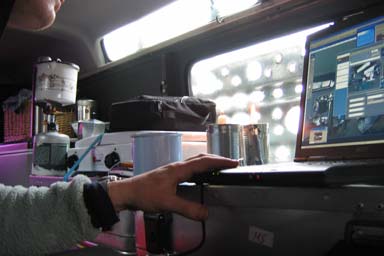
Find the location of a particular element. keyboard is located at coordinates (297, 166).